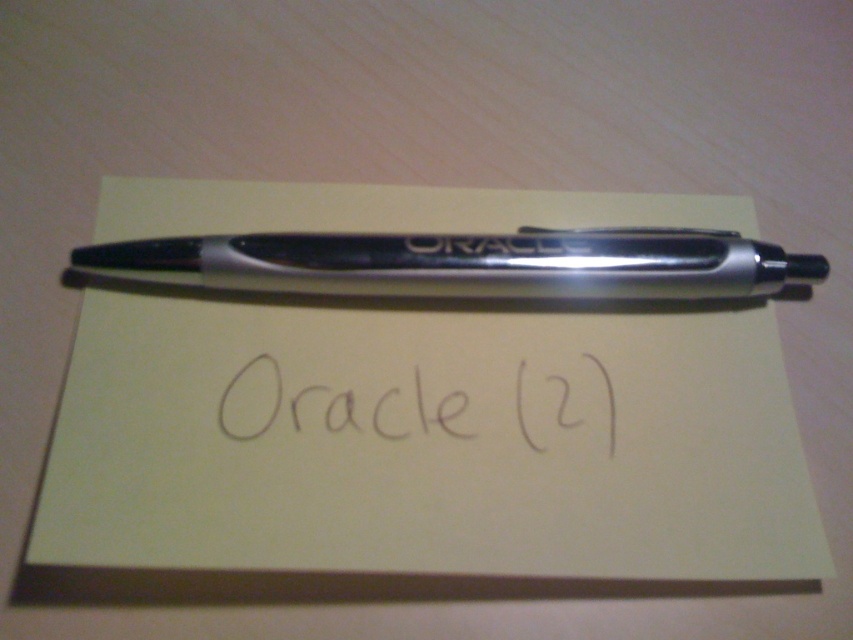
Question: Is metallic silver pen at center below black ink writing at center?

Choices:
 (A) yes
 (B) no

Answer: (B)

Question: Which point appears closest to the camera in this image?

Choices:
 (A) (610, 413)
 (B) (270, 525)

Answer: (B)

Question: Which point is closer to the camera taking this photo?

Choices:
 (A) (469, 433)
 (B) (49, 529)

Answer: (B)

Question: Is metallic silver pen at center to the left of black ink writing at center from the viewer's perspective?

Choices:
 (A) no
 (B) yes

Answer: (A)

Question: Which point appears farthest from the camera in this image?

Choices:
 (A) coord(207,355)
 (B) coord(374,424)
 (C) coord(219,285)

Answer: (C)

Question: Can you confirm if metallic silver pen at center is positioned below black ink writing at center?

Choices:
 (A) yes
 (B) no

Answer: (B)